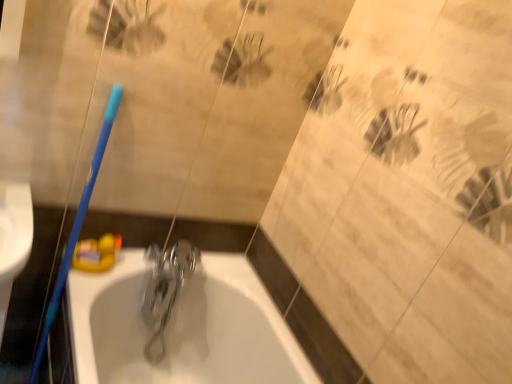
Question: In terms of width, does blue plastic toothbrush at left look wider or thinner when compared to polished metallic faucet at center?

Choices:
 (A) wide
 (B) thin

Answer: (A)

Question: Considering the positions of blue plastic toothbrush at left and polished metallic faucet at center in the image, is blue plastic toothbrush at left bigger or smaller than polished metallic faucet at center?

Choices:
 (A) big
 (B) small

Answer: (A)

Question: Which object is positioned closest to the blue plastic toothbrush at left?

Choices:
 (A) polished metallic faucet at center
 (B) white glossy bathtub at center

Answer: (A)

Question: Estimate the real-world distances between objects in this image. Which object is farther from the blue plastic toothbrush at left?

Choices:
 (A) white glossy bathtub at center
 (B) polished metallic faucet at center

Answer: (A)